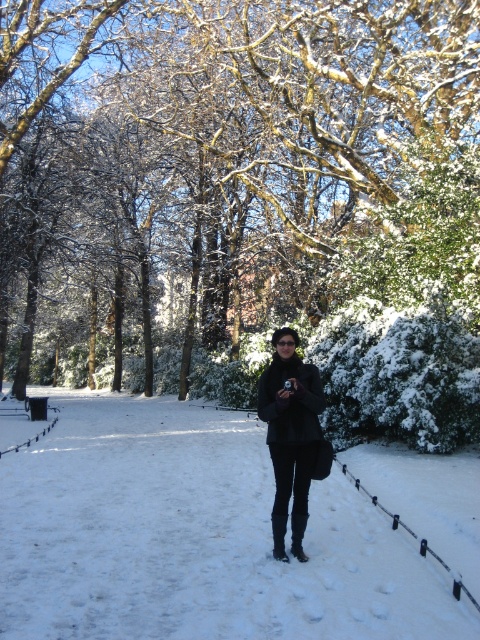
Is white fluffy snow at center taller than black matte coat at center?

No.

Based on the photo, is white fluffy snow at center wider than black matte coat at center?

Indeed, white fluffy snow at center has a greater width compared to black matte coat at center.

What do you see at coordinates (195, 538) in the screenshot? I see `white fluffy snow at center` at bounding box center [195, 538].

At what (x,y) coordinates should I click in order to perform the action: click on white fluffy snow at center. Please return your answer as a coordinate pair (x, y). The width and height of the screenshot is (480, 640). Looking at the image, I should click on (195, 538).

Can you confirm if snow-covered branches at center is wider than black matte coat at center?

Yes, snow-covered branches at center is wider than black matte coat at center.

Can you confirm if snow-covered branches at center is positioned to the left of black matte coat at center?

Indeed, snow-covered branches at center is positioned on the left side of black matte coat at center.

The image size is (480, 640). Describe the element at coordinates (215, 147) in the screenshot. I see `snow-covered branches at center` at that location.

Where is `snow-covered branches at center`? snow-covered branches at center is located at coordinates (215, 147).

Is snow-covered branches at center positioned in front of white fluffy snow at center?

No, it is not.

Where is `snow-covered branches at center`? snow-covered branches at center is located at coordinates (215, 147).